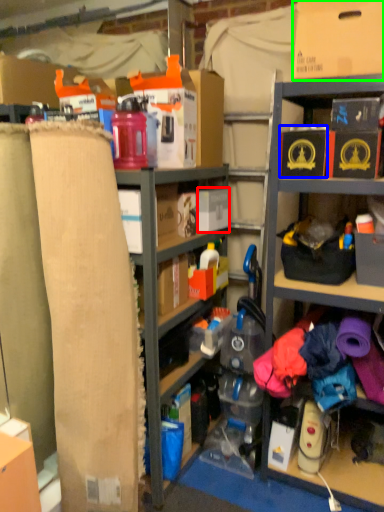
Question: Based on their relative distances, which object is farther from storage box (highlighted by a red box)? Choose from storage box (highlighted by a blue box) and cardboard box (highlighted by a green box).

Choices:
 (A) storage box
 (B) cardboard box

Answer: (B)